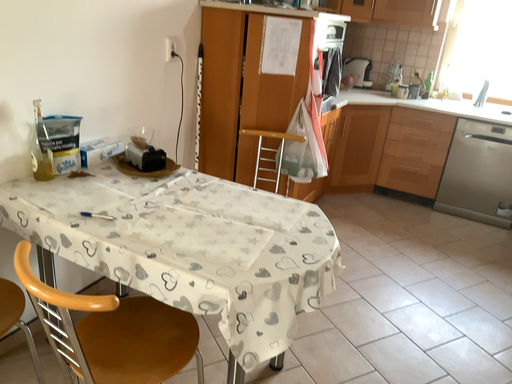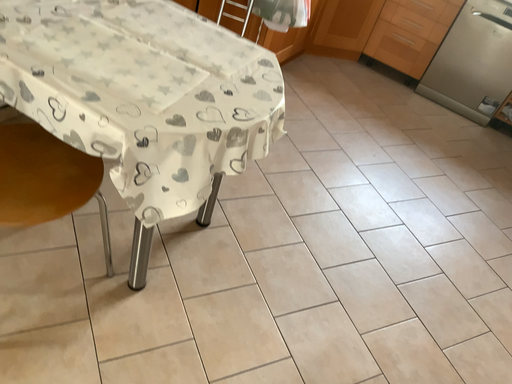
Question: How did the camera likely rotate when shooting the video?

Choices:
 (A) rotated downward
 (B) rotated upward

Answer: (A)